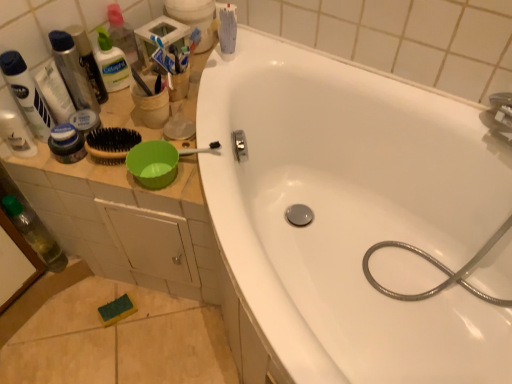
Question: Is clear plastic bottle at upper left, the 2th bottle positioned from the bottom, at the right side of metallic silver garden hose at upper right?

Choices:
 (A) yes
 (B) no

Answer: (B)

Question: From the image's perspective, is clear plastic bottle at upper left, the 2th bottle positioned from the bottom, on top of metallic silver garden hose at upper right?

Choices:
 (A) no
 (B) yes

Answer: (B)

Question: Is the surface of clear plastic bottle at upper left, marked as the first bottle in a top-to-bottom arrangement, in direct contact with metallic silver garden hose at upper right?

Choices:
 (A) no
 (B) yes

Answer: (A)

Question: Is clear plastic bottle at upper left, positioned as the second bottle in left-to-right order, behind metallic silver garden hose at upper right?

Choices:
 (A) no
 (B) yes

Answer: (B)

Question: Is metallic silver garden hose at upper right completely or partially inside clear plastic bottle at upper left, the 2th bottle positioned from the bottom?

Choices:
 (A) yes
 (B) no

Answer: (B)

Question: Can you confirm if clear plastic bottle at upper left, the 2th bottle positioned from the bottom, is shorter than metallic silver garden hose at upper right?

Choices:
 (A) no
 (B) yes

Answer: (B)

Question: Is translucent plastic bottle at upper left, which is the first toiletry in left-to-right order, oriented away from matte white tube at upper left, the 2th toiletry viewed from the left?

Choices:
 (A) no
 (B) yes

Answer: (A)

Question: Can you confirm if translucent plastic bottle at upper left, placed as the fourth toiletry when sorted from right to left, is wider than matte white tube at upper left, the 2th toiletry viewed from the left?

Choices:
 (A) no
 (B) yes

Answer: (B)

Question: From a real-world perspective, is translucent plastic bottle at upper left, which is the first toiletry in left-to-right order, located higher than matte white tube at upper left, the 2th toiletry viewed from the left?

Choices:
 (A) yes
 (B) no

Answer: (B)

Question: Can you confirm if translucent plastic bottle at upper left, which is the first toiletry in left-to-right order, is positioned to the left of matte white tube at upper left, the 2th toiletry viewed from the left?

Choices:
 (A) no
 (B) yes

Answer: (B)

Question: Is translucent plastic bottle at upper left, which is the first toiletry in left-to-right order, shorter than matte white tube at upper left, the 2th toiletry viewed from the left?

Choices:
 (A) yes
 (B) no

Answer: (A)

Question: Considering the relative positions of translucent plastic bottle at upper left, placed as the fourth toiletry when sorted from right to left, and matte white tube at upper left, the 2th toiletry viewed from the left, in the image provided, is translucent plastic bottle at upper left, placed as the fourth toiletry when sorted from right to left, in front of matte white tube at upper left, the 2th toiletry viewed from the left,?

Choices:
 (A) yes
 (B) no

Answer: (B)

Question: Does shiny metallic can at upper left, the 4th toiletry from the left, appear on the right side of clear plastic bottle at upper left, positioned as the second bottle in left-to-right order?

Choices:
 (A) no
 (B) yes

Answer: (A)